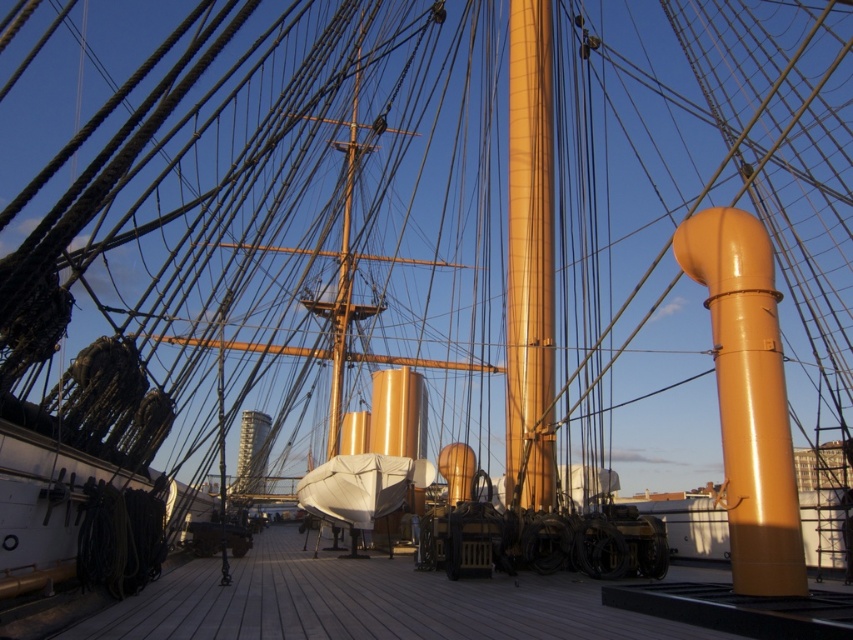
From the picture: You are a sailor on the ship deck. You need to retrieve an item from the wooden at center which is blocking your view of the matte gold mast at center. What should you do to see the mast clearly?

Move the wooden at center aside or move around it so that it no longer obstructs your view of the matte gold mast at center. Since the wooden at center is in front of the matte gold mast at center, moving it or moving around it will allow you to see the mast clearly.

In the scene shown: You are a sailor on the ship and need to secure a small package using the objects available. Which object, the glossy orange pipe at right or the matte gold mast at center, would be more suitable for tying the package due to its size?

The glossy orange pipe at right has a smaller size compared to the matte gold mast at center, so it would be more suitable for tying the small package due to its smaller size.

You are a sailor on the ship and need to secure a rope. You have two options for tying it to either the wooden at center or the glossy orange pipe at right. Which object has a larger surface area to tie the rope around?

The wooden at center has a larger surface area than the glossy orange pipe at right because it is wider, making it more suitable for tying the rope around.